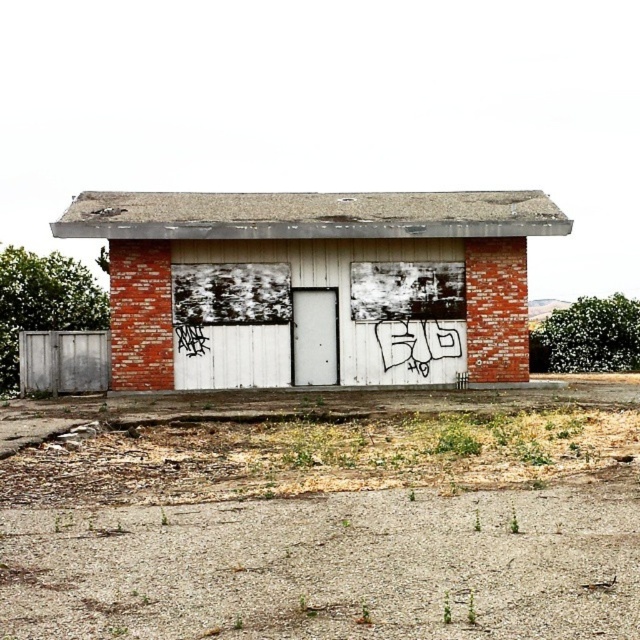
Image resolution: width=640 pixels, height=640 pixels. What do you see at coordinates (314, 282) in the screenshot?
I see `brick building at center` at bounding box center [314, 282].

You are a GUI agent. You are given a task and a screenshot of the screen. Output one action in this format:
    pyautogui.click(x=<x>, y=<y>)
    Task: Click on the brick building at center
    This screenshot has height=640, width=640.
    Given the screenshot: What is the action you would take?
    pos(314,282)

Can you confirm if gray metallic gate at lower left is positioned to the left of white matte garage door at center?

Correct, you'll find gray metallic gate at lower left to the left of white matte garage door at center.

Identify the location of gray metallic gate at lower left. The image size is (640, 640). (64, 362).

Which is below, brick building at center or gray metallic gate at lower left?

gray metallic gate at lower left

Can you confirm if brick building at center is bigger than gray metallic gate at lower left?

Indeed, brick building at center has a larger size compared to gray metallic gate at lower left.

What do you see at coordinates (314, 282) in the screenshot? I see `brick building at center` at bounding box center [314, 282].

Image resolution: width=640 pixels, height=640 pixels. What are the coordinates of `brick building at center` in the screenshot? It's located at (314, 282).